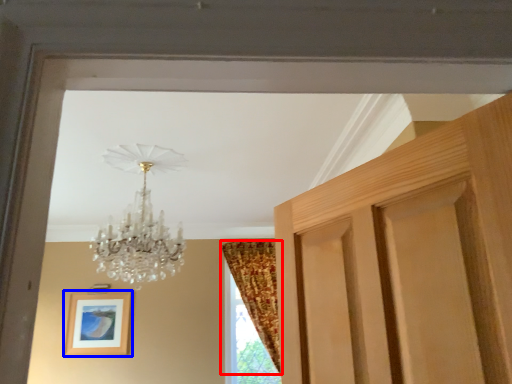
Question: Among these objects, which one is farthest to the camera, curtain (highlighted by a red box) or picture frame (highlighted by a blue box)?

Choices:
 (A) curtain
 (B) picture frame

Answer: (B)